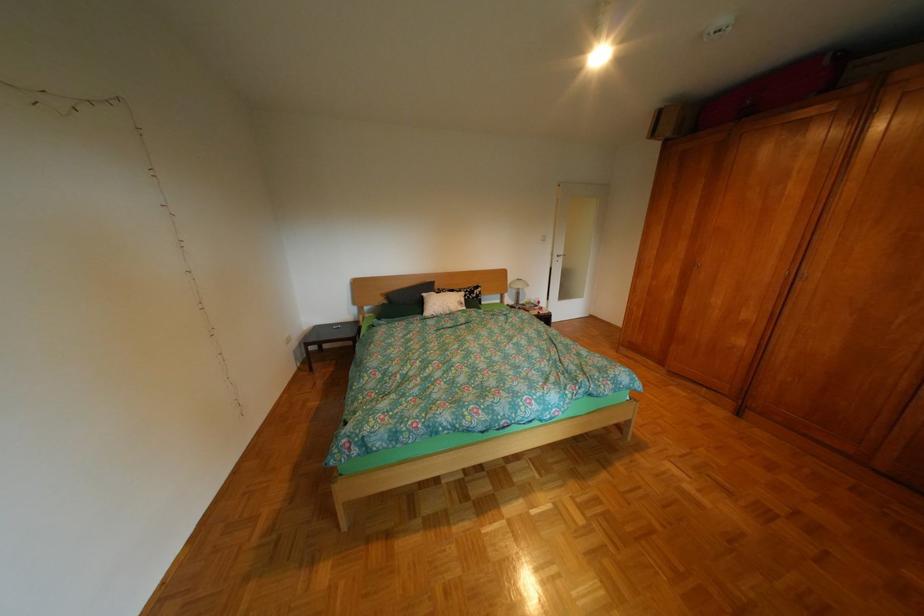
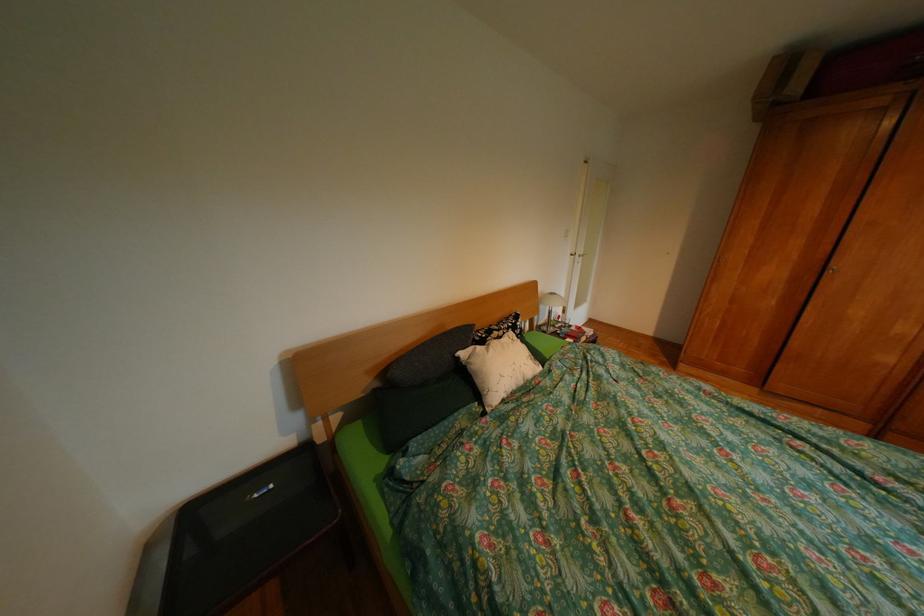
The images are taken continuously from a first-person perspective. In which direction are you moving?

The movement direction of the cameraman is left, forward.